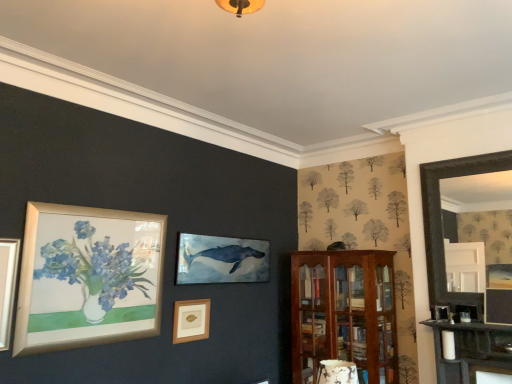
The image size is (512, 384). Describe the element at coordinates (344, 313) in the screenshot. I see `mahogany wooden cabinet at right` at that location.

Identify the location of wooden picture frame at center. (191, 320).

The width and height of the screenshot is (512, 384). Describe the element at coordinates (441, 220) in the screenshot. I see `black wooden fireplace at right` at that location.

The width and height of the screenshot is (512, 384). I want to click on mahogany wooden cabinet at right, so click(344, 313).

From a real-world perspective, relative to black wooden fireplace at right, is mahogany wooden cabinet at right vertically above or below?

mahogany wooden cabinet at right is below black wooden fireplace at right.

Does mahogany wooden cabinet at right have a lesser height compared to black wooden fireplace at right?

Incorrect, the height of mahogany wooden cabinet at right does not fall short of that of black wooden fireplace at right.

Can you tell me how much mahogany wooden cabinet at right and black wooden fireplace at right differ in facing direction?

They differ by 1.24 degrees in their facing directions.

Is mahogany wooden cabinet at right closer to the viewer compared to wooden picture frame at center?

No, it is not.

Could you tell me if mahogany wooden cabinet at right is turned towards wooden picture frame at center?

Yes, mahogany wooden cabinet at right is aimed at wooden picture frame at center.

In the image, there is a wooden picture frame at center. Find the location of `shelf below it (from the image's perspective)`. shelf below it (from the image's perspective) is located at coordinates (344, 313).

Looking at this image, in terms of height, does mahogany wooden cabinet at right look taller or shorter compared to wooden picture frame at center?

In the image, mahogany wooden cabinet at right appears to be taller than wooden picture frame at center.

From the image's perspective, does black wooden fireplace at right appear higher than wooden picture frame at center?

Correct, black wooden fireplace at right appears higher than wooden picture frame at center in the image.

Is black wooden fireplace at right taller or shorter than wooden picture frame at center?

In the image, black wooden fireplace at right appears to be taller than wooden picture frame at center.

Is black wooden fireplace at right at the right side of wooden picture frame at center?

Correct, you'll find black wooden fireplace at right to the right of wooden picture frame at center.

Who is taller, wooden picture frame at center or black wooden fireplace at right?

Standing taller between the two is black wooden fireplace at right.

Would you say black wooden fireplace at right is part of wooden picture frame at center's contents?

No, wooden picture frame at center does not contain black wooden fireplace at right.

Would you say wooden picture frame at center is a long distance from black wooden fireplace at right?

Yes, wooden picture frame at center and black wooden fireplace at right are located far from each other.

From the picture: From a real-world perspective, which is physically below, wooden picture frame at center or black wooden fireplace at right?

wooden picture frame at center is physically lower.

From the image's perspective, is black wooden fireplace at right beneath mahogany wooden cabinet at right?

No.

From a real-world perspective, which is physically below, black wooden fireplace at right or mahogany wooden cabinet at right?

From a 3D spatial view, mahogany wooden cabinet at right is below.

Measure the distance between black wooden fireplace at right and mahogany wooden cabinet at right.

A distance of 32.53 inches exists between black wooden fireplace at right and mahogany wooden cabinet at right.

Are wooden picture frame at center and mahogany wooden cabinet at right beside each other?

No, wooden picture frame at center is not touching mahogany wooden cabinet at right.

From the image's perspective, would you say wooden picture frame at center is positioned over mahogany wooden cabinet at right?

Yes.

Is wooden picture frame at center facing away from mahogany wooden cabinet at right?

wooden picture frame at center does not have its back to mahogany wooden cabinet at right.

The height and width of the screenshot is (384, 512). In order to click on fireplace that is above the mahogany wooden cabinet at right (from a real-world perspective) in this screenshot , I will do `click(441, 220)`.

In order to click on picture frame on the left of mahogany wooden cabinet at right in this screenshot , I will do `click(191, 320)`.

Looking at the image, which one is located further to wooden picture frame at center, black wooden fireplace at right or mahogany wooden cabinet at right?

The object further to wooden picture frame at center is black wooden fireplace at right.

Estimate the real-world distances between objects in this image. Which object is closer to black wooden fireplace at right, wooden picture frame at center or mahogany wooden cabinet at right?

mahogany wooden cabinet at right is positioned closer to the anchor black wooden fireplace at right.

Looking at the image, which one is located closer to black wooden fireplace at right, mahogany wooden cabinet at right or wooden picture frame at center?

mahogany wooden cabinet at right is positioned closer to the anchor black wooden fireplace at right.

When comparing their distances from mahogany wooden cabinet at right, does black wooden fireplace at right or wooden picture frame at center seem further?

Based on the image, wooden picture frame at center appears to be further to mahogany wooden cabinet at right.

From the image, which object appears to be nearer to wooden picture frame at center, mahogany wooden cabinet at right or black wooden fireplace at right?

Based on the image, mahogany wooden cabinet at right appears to be nearer to wooden picture frame at center.

Estimate the real-world distances between objects in this image. Which object is closer to mahogany wooden cabinet at right, wooden picture frame at center or black wooden fireplace at right?

black wooden fireplace at right is positioned closer to the anchor mahogany wooden cabinet at right.

At what (x,y) coordinates should I click in order to perform the action: click on shelf between wooden picture frame at center and black wooden fireplace at right from left to right. Please return your answer as a coordinate pair (x, y). The width and height of the screenshot is (512, 384). Looking at the image, I should click on (344, 313).